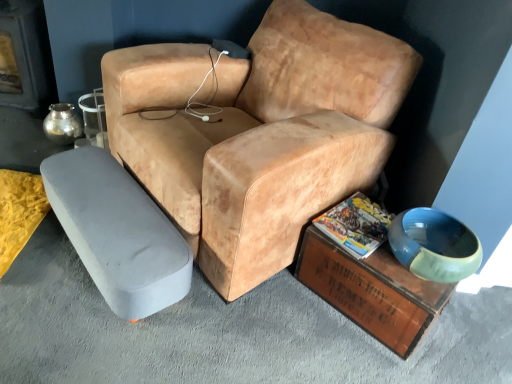
Question: Which is correct: leather-like tan chair at center is inside metallic silver fireplace at left, or outside of it?

Choices:
 (A) inside
 (B) outside

Answer: (B)

Question: Is leather-like tan chair at center wider or thinner than metallic silver fireplace at left?

Choices:
 (A) wide
 (B) thin

Answer: (A)

Question: Which of these objects is positioned closest to the wooden crate at lower right, placed as the first table when sorted from right to left?

Choices:
 (A) gray fabric ottoman at lower left, which is the 2th table in right-to-left order
 (B) smooth gray concrete at lower left
 (C) leather-like tan chair at center
 (D) metallic silver fireplace at left
 (E) matte paper magazine at lower right

Answer: (E)

Question: Which object is positioned farthest from the smooth gray concrete at lower left?

Choices:
 (A) wooden crate at lower right, placed as the first table when sorted from right to left
 (B) matte paper magazine at lower right
 (C) metallic silver fireplace at left
 (D) gray fabric ottoman at lower left, acting as the first table starting from the left
 (E) leather-like tan chair at center

Answer: (C)